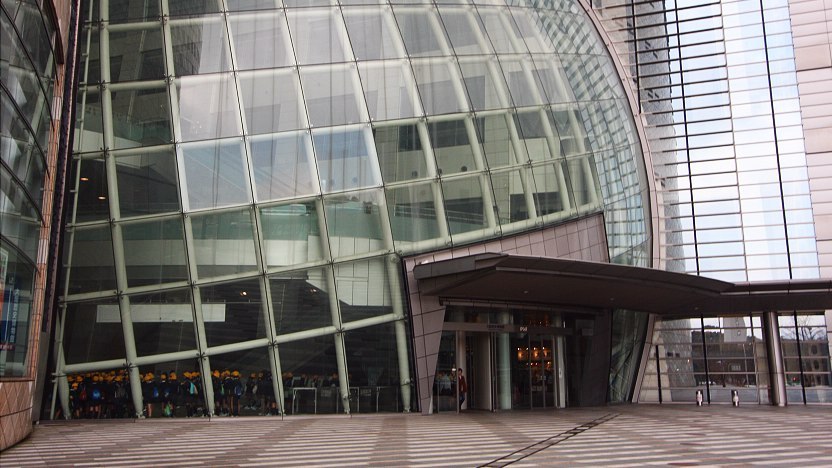
Locate an element on the screen. This screenshot has height=468, width=832. glass doors is located at coordinates (536, 377).